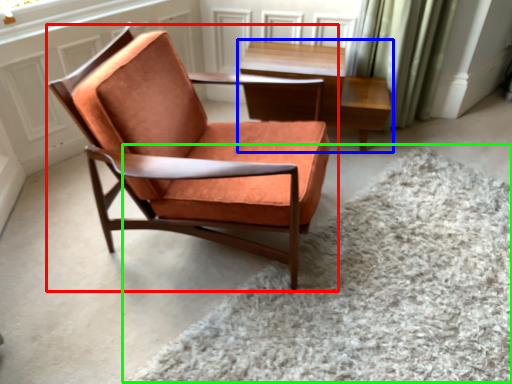
Question: Which object is positioned farthest from chair (highlighted by a red box)? Select from table (highlighted by a blue box) and plain (highlighted by a green box).

Choices:
 (A) table
 (B) plain

Answer: (A)